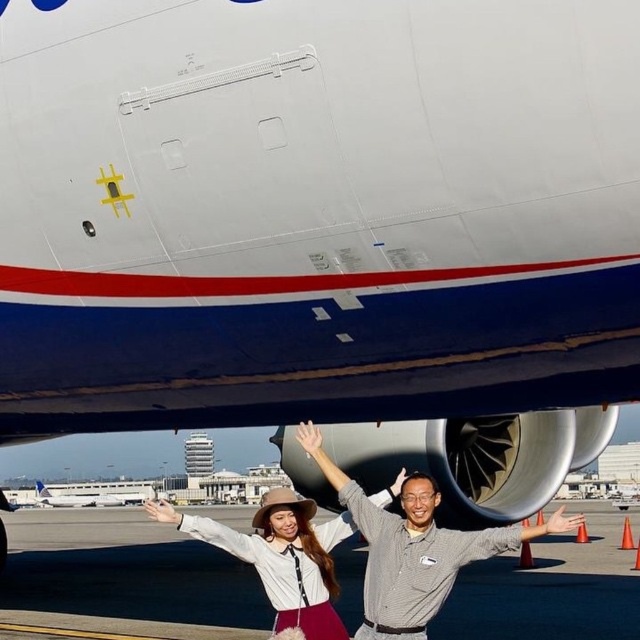
Who is positioned more to the left, gray striped shirt at center or white matte airplane at center?

Positioned to the left is white matte airplane at center.

This screenshot has width=640, height=640. Identify the location of gray striped shirt at center. tap(413, 547).

The image size is (640, 640). Identify the location of gray striped shirt at center. 413,547.

Can you confirm if smooth gray arm at center is smaller than matte gray shirt at center?

Actually, smooth gray arm at center might be larger than matte gray shirt at center.

In the scene shown: Does smooth gray arm at center have a greater width compared to matte gray shirt at center?

Yes.

What do you see at coordinates (515, 536) in the screenshot?
I see `smooth gray arm at center` at bounding box center [515, 536].

Find the location of a particular element. The width and height of the screenshot is (640, 640). smooth gray arm at center is located at coordinates (515, 536).

Which is above, smooth asphalt tarmac at center or white matte airplane at center?

smooth asphalt tarmac at center is above.

Describe the element at coordinates (128, 572) in the screenshot. I see `smooth asphalt tarmac at center` at that location.

Does point (509, 588) lie behind point (120, 504)?

No.

Image resolution: width=640 pixels, height=640 pixels. I want to click on smooth asphalt tarmac at center, so point(128,572).